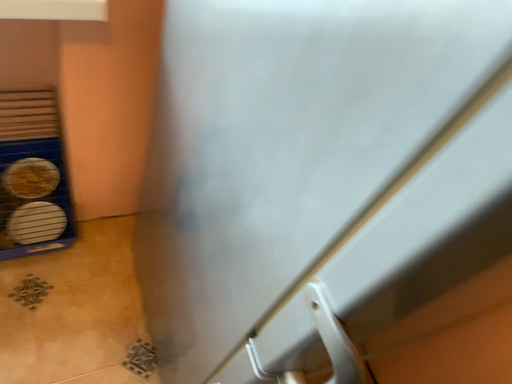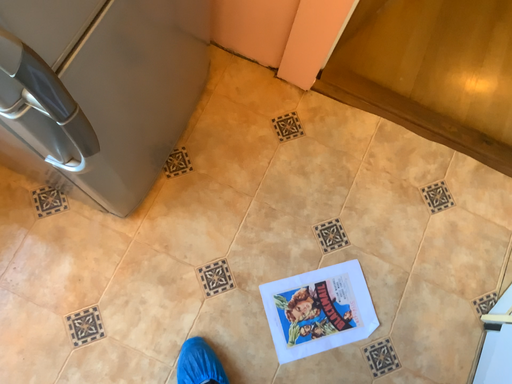
Question: Which way did the camera rotate in the video?

Choices:
 (A) rotated upward
 (B) rotated downward

Answer: (B)